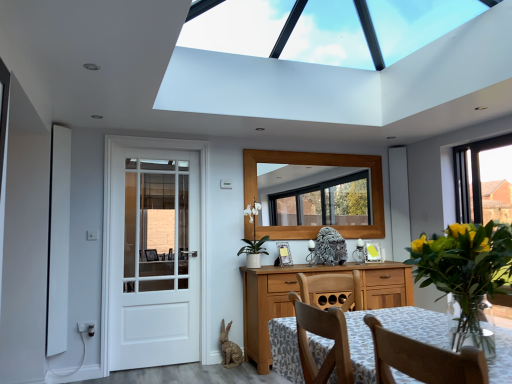
Identify the location of blank space above wooden frame mirror at center (from a real-world perspective). click(326, 146).